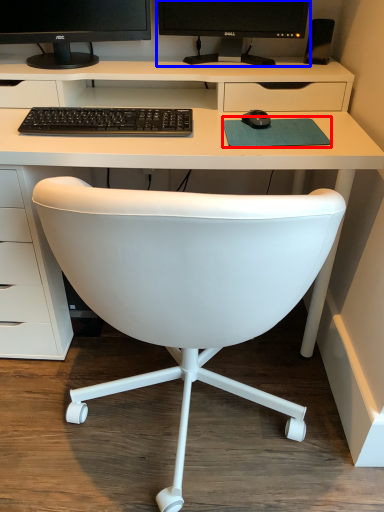
Question: Which of the following is the farthest to the observer, mousepad (highlighted by a red box) or computer monitor (highlighted by a blue box)?

Choices:
 (A) mousepad
 (B) computer monitor

Answer: (B)